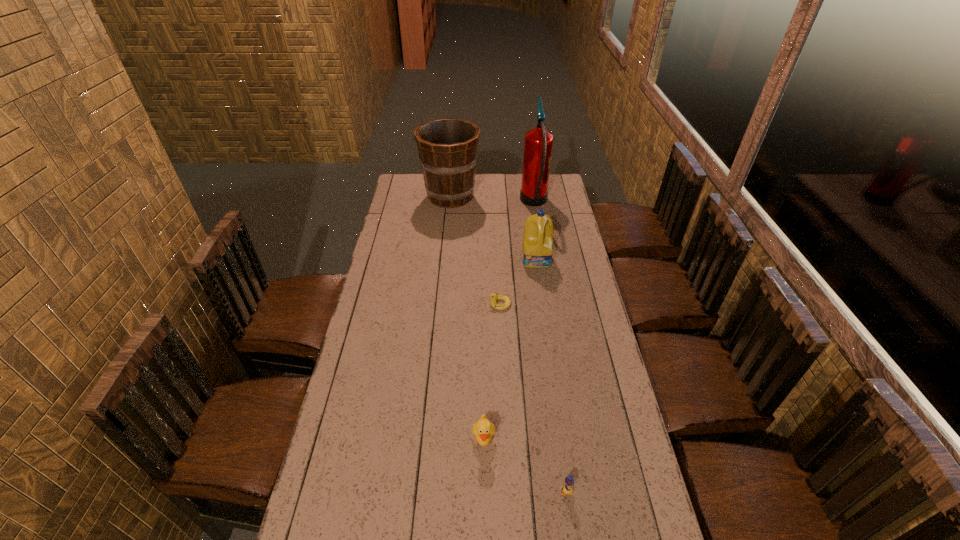
The width and height of the screenshot is (960, 540). Identify the location of vacant space located 0.350m on the front of the tallest object. click(x=545, y=269).

I want to click on free space located 0.070m on the back of the bucket, so click(452, 175).

Where is `free space located 0.250m on the label of the detergent`? This screenshot has width=960, height=540. free space located 0.250m on the label of the detergent is located at coordinates (544, 310).

Locate an element on the screen. The height and width of the screenshot is (540, 960). free space located 0.120m on the front-facing side of the third shortest object is located at coordinates (484, 499).

You are a GUI agent. You are given a task and a screenshot of the screen. Output one action in this format:
    pyautogui.click(x=<x>, y=<y>)
    Task: Click on the free location located on the face of the shortest duckling
    
    Given the screenshot: What is the action you would take?
    pyautogui.click(x=400, y=303)

Find the location of `blank area located on the face of the shortest duckling`. blank area located on the face of the shortest duckling is located at coordinates (407, 303).

Locate an element on the screen. This screenshot has height=540, width=960. vacant region located on the face of the shortest duckling is located at coordinates (418, 303).

This screenshot has width=960, height=540. Find the location of `fire extinguisher that is at the far edge`. fire extinguisher that is at the far edge is located at coordinates (538, 143).

What are the coordinates of `bucket that is at the far edge` in the screenshot? It's located at [x=447, y=147].

Locate an element on the screen. This screenshot has width=960, height=540. object that is at the left edge is located at coordinates (447, 147).